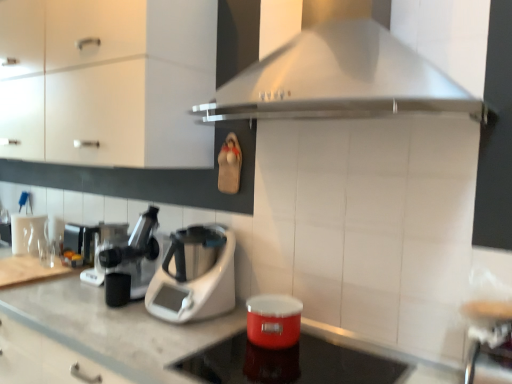
Where is `vacant space situated on the left part of white plastic coffee machine at center, placed as the third coffee machine when sorted from left to right`? The height and width of the screenshot is (384, 512). vacant space situated on the left part of white plastic coffee machine at center, placed as the third coffee machine when sorted from left to right is located at coordinates (x=81, y=297).